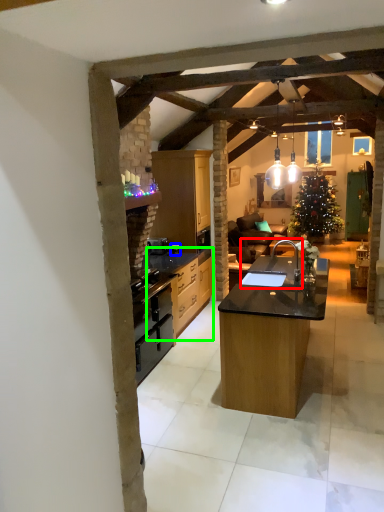
Question: Based on their relative distances, which object is farther from sink (highlighted by a red box)? Choose from appliance (highlighted by a blue box) and cabinetry (highlighted by a green box).

Choices:
 (A) appliance
 (B) cabinetry

Answer: (A)